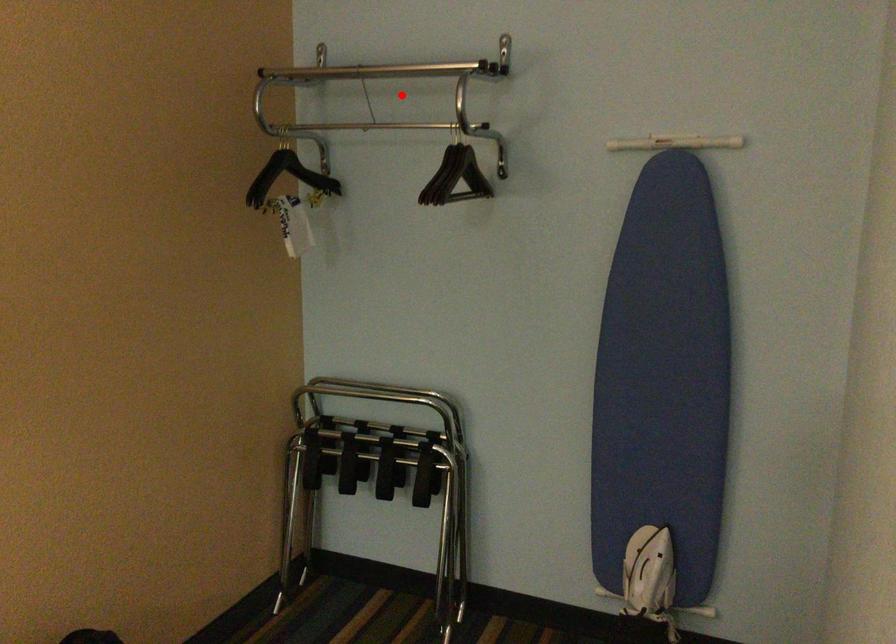
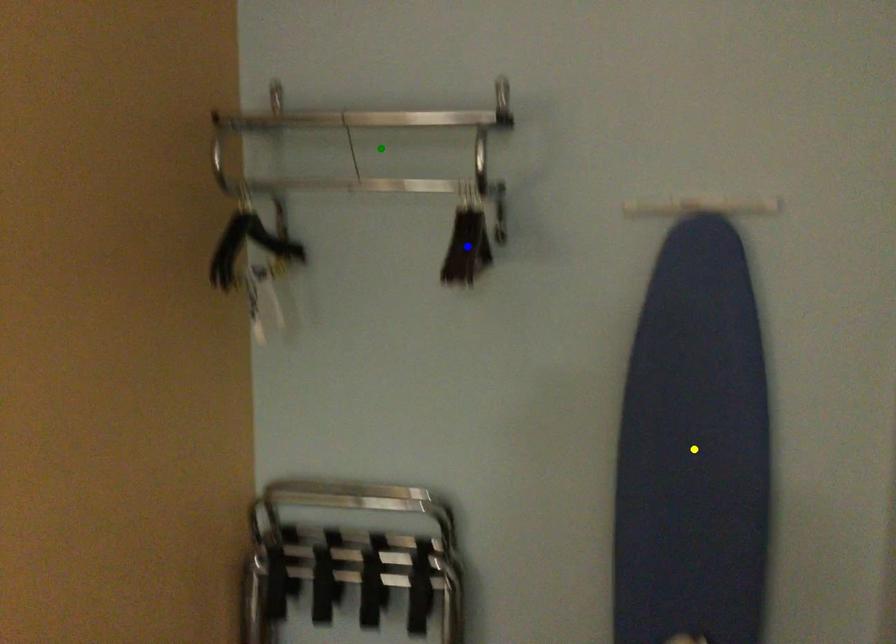
Question: I am providing you with two images of the same scene from different viewpoints. A red point is marked on the first image. You are given multiple points on the second image. Which mark in image 2 goes with the point in image 1?

Choices:
 (A) blue point
 (B) yellow point
 (C) green point

Answer: (C)